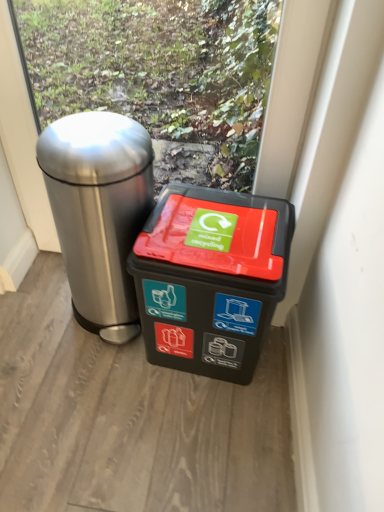
Question: In terms of height, does polished stainless steel trash can at left, which ranks as the second waste container in right-to-left order, look taller or shorter compared to black plastic recycling bin at center, which is the first waste container from right to left?

Choices:
 (A) tall
 (B) short

Answer: (A)

Question: From the image's perspective, is polished stainless steel trash can at left, marked as the 1th waste container in a left-to-right arrangement, above or below black plastic recycling bin at center, which is the first waste container from right to left?

Choices:
 (A) above
 (B) below

Answer: (A)

Question: Do you think polished stainless steel trash can at left, which ranks as the second waste container in right-to-left order, is within black plastic recycling bin at center, the 2th waste container viewed from the left, or outside of it?

Choices:
 (A) inside
 (B) outside

Answer: (B)

Question: In terms of size, does black plastic recycling bin at center, which is the first waste container from right to left, appear bigger or smaller than polished stainless steel trash can at left, marked as the 1th waste container in a left-to-right arrangement?

Choices:
 (A) small
 (B) big

Answer: (A)

Question: From a real-world perspective, relative to polished stainless steel trash can at left, marked as the 1th waste container in a left-to-right arrangement, is black plastic recycling bin at center, the 2th waste container viewed from the left, vertically above or below?

Choices:
 (A) above
 (B) below

Answer: (B)

Question: Looking at their shapes, would you say black plastic recycling bin at center, the 2th waste container viewed from the left, is wider or thinner than polished stainless steel trash can at left, which ranks as the second waste container in right-to-left order?

Choices:
 (A) thin
 (B) wide

Answer: (A)

Question: Is black plastic recycling bin at center, which is the first waste container from right to left, in front of or behind polished stainless steel trash can at left, marked as the 1th waste container in a left-to-right arrangement, in the image?

Choices:
 (A) front
 (B) behind

Answer: (B)